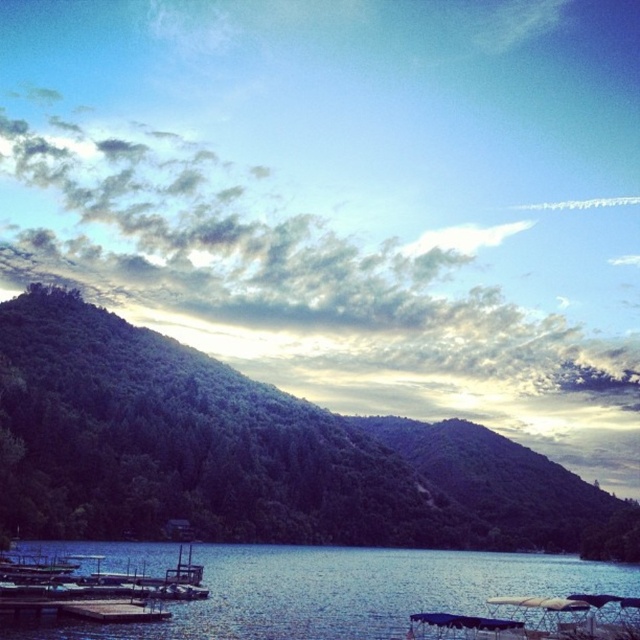
Question: Which point is farther from the camera taking this photo?

Choices:
 (A) (67, 605)
 (B) (257, 552)
 (C) (433, 458)

Answer: (C)

Question: Does green forested hill at center appear on the right side of blue water at lower center?

Choices:
 (A) no
 (B) yes

Answer: (B)

Question: Which of the following is the farthest from the observer?

Choices:
 (A) (150, 448)
 (B) (97, 598)
 (C) (374, 576)

Answer: (A)

Question: Is green forested hill at center below blue water at lower center?

Choices:
 (A) no
 (B) yes

Answer: (A)

Question: Does blue water at lower center have a lesser width compared to brown wooden dock at lower left?

Choices:
 (A) yes
 (B) no

Answer: (B)

Question: Among these objects, which one is nearest to the camera?

Choices:
 (A) green forested hill at center
 (B) brown wooden dock at lower left
 (C) blue water at lower center

Answer: (C)